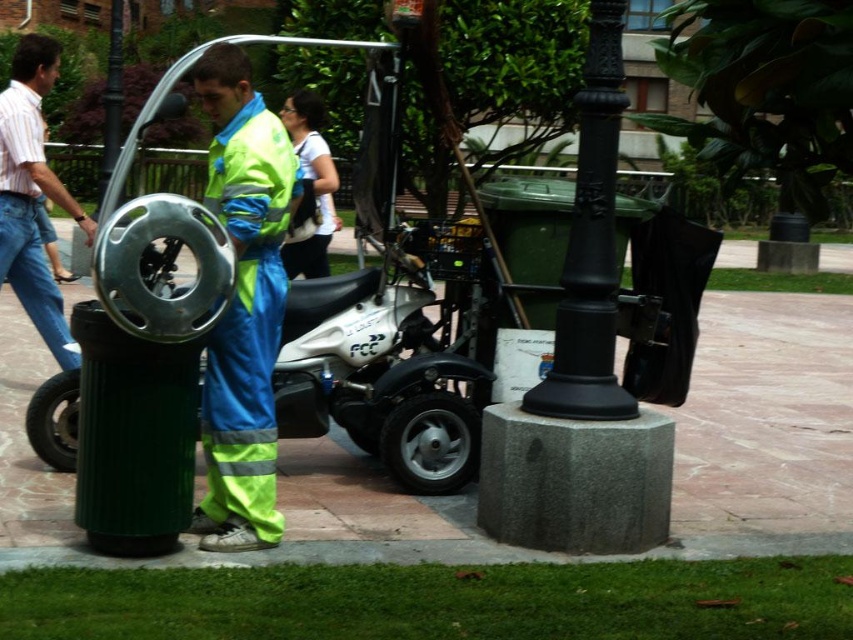
Question: Can you confirm if black rubber tire at lower center is positioned above black rubber tire at lower left?

Choices:
 (A) no
 (B) yes

Answer: (A)

Question: Among these points, which one is nearest to the camera?

Choices:
 (A) (13, 228)
 (B) (289, 211)
 (C) (415, 301)

Answer: (B)

Question: Is high visibility fabric jumpsuit at center smaller than black rubber tire at lower center?

Choices:
 (A) yes
 (B) no

Answer: (B)

Question: Does striped cotton shirt at left lie in front of black rubber tire at lower center?

Choices:
 (A) no
 (B) yes

Answer: (A)

Question: Among these objects, which one is nearest to the camera?

Choices:
 (A) white matte motorcycle at center
 (B) high visibility fabric jumpsuit at center
 (C) striped cotton shirt at left

Answer: (B)

Question: Among these points, which one is nearest to the camera?

Choices:
 (A) (32, 440)
 (B) (216, 429)
 (C) (4, 218)

Answer: (B)